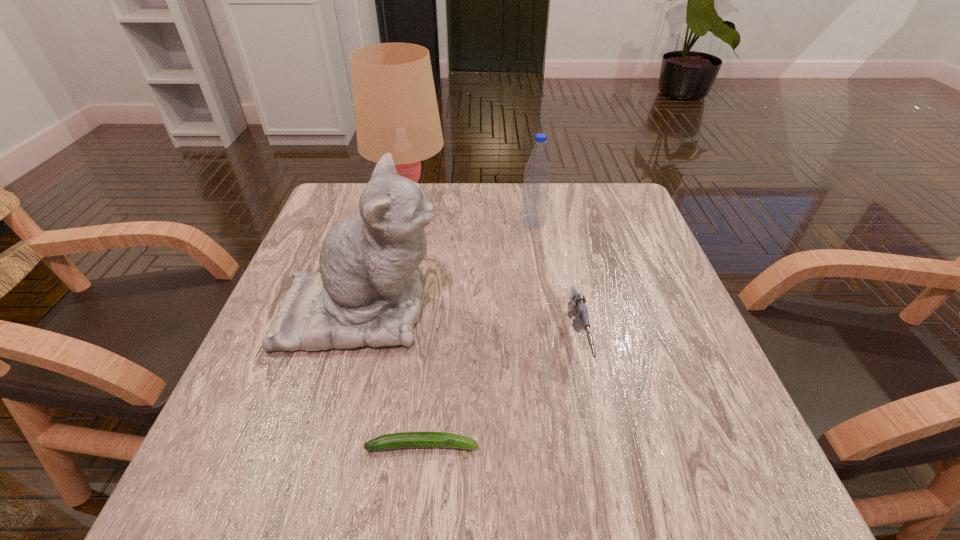
The height and width of the screenshot is (540, 960). What are the coordinates of `lampshade` in the screenshot? It's located at (396, 111).

Locate an element on the screen. This screenshot has width=960, height=540. cat is located at coordinates (368, 292).

Find the location of a particular element. the second object from right to left is located at coordinates (535, 192).

This screenshot has height=540, width=960. In order to click on water bottle in this screenshot , I will do `click(535, 192)`.

Locate an element on the screen. This screenshot has width=960, height=540. gun is located at coordinates (576, 306).

What are the coordinates of `the fourth tallest object` in the screenshot? It's located at (576, 306).

Locate an element on the screen. This screenshot has width=960, height=540. the nearest object is located at coordinates (405, 439).

Locate an element on the screen. The image size is (960, 540). the shortest object is located at coordinates (405, 439).

Find the location of `vacant space situated 0.060m on the front of the lampshade`. vacant space situated 0.060m on the front of the lampshade is located at coordinates 400,241.

Identify the location of vacant space located 0.170m on the front-facing side of the cat. (526, 309).